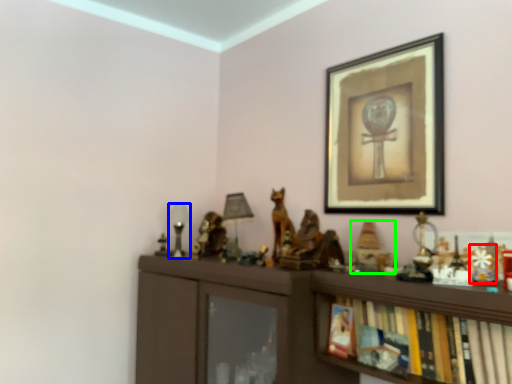
Question: Estimate the real-world distances between objects in this image. Which object is closer to toy (highlighted by a red box), table lamp (highlighted by a blue box) or toy (highlighted by a green box)?

Choices:
 (A) table lamp
 (B) toy

Answer: (B)